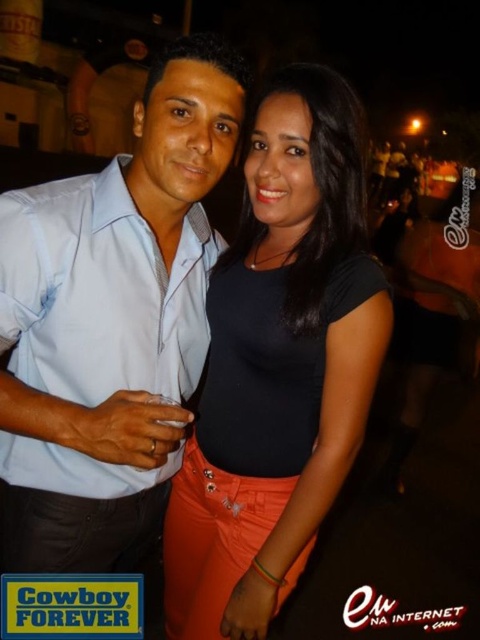
Can you confirm if light blue shirt at center is positioned above black matte shirt at center?

Yes.

Is light blue shirt at center to the left of black matte shirt at center from the viewer's perspective?

Correct, you'll find light blue shirt at center to the left of black matte shirt at center.

Between point (99, 253) and point (273, 305), which one is positioned behind?

The point (273, 305) is behind.

I want to click on light blue shirt at center, so click(111, 323).